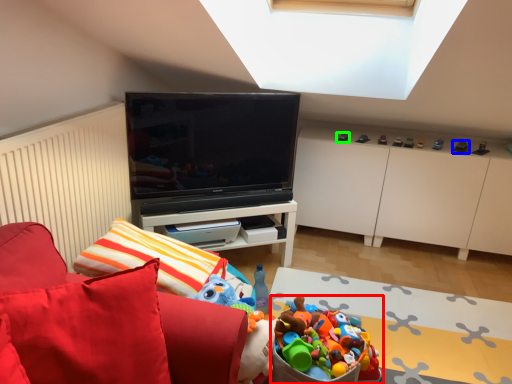
Question: Which object is the closest to the toy (highlighted by a red box)? Choose among these: toy (highlighted by a blue box) or toy (highlighted by a green box).

Choices:
 (A) toy
 (B) toy

Answer: (B)